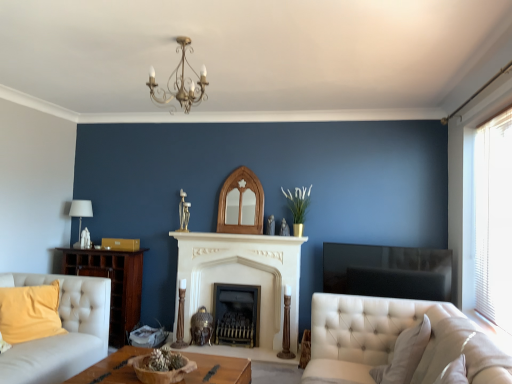
Question: Is white blinds at right inside or outside of white stone fireplace at center, which is the second fireplace in right-to-left order?

Choices:
 (A) inside
 (B) outside

Answer: (B)

Question: In the image, is white blinds at right positioned in front of or behind white stone fireplace at center, which is the second fireplace in right-to-left order?

Choices:
 (A) behind
 (B) front

Answer: (B)

Question: Which is nearer to the white marble fireplace at center?

Choices:
 (A) wooden bowl at center
 (B) gray fabric pillow at lower right, arranged as the 1th pillow when viewed from the front
 (C) white stone fireplace at center, which is the second fireplace in right-to-left order
 (D) white blinds at right
 (E) white tufted fabric couch at lower right

Answer: (C)

Question: Which of these objects is positioned farthest from the gray fabric pillow at lower right, which is the first pillow from right to left?

Choices:
 (A) white marble fireplace at center
 (B) velvet yellow pillow at lower left, acting as the first pillow starting from the back
 (C) gold metallic chandelier at upper center
 (D) black matte fireplace at center, which is the second fireplace in left-to-right order
 (E) white blinds at right

Answer: (B)